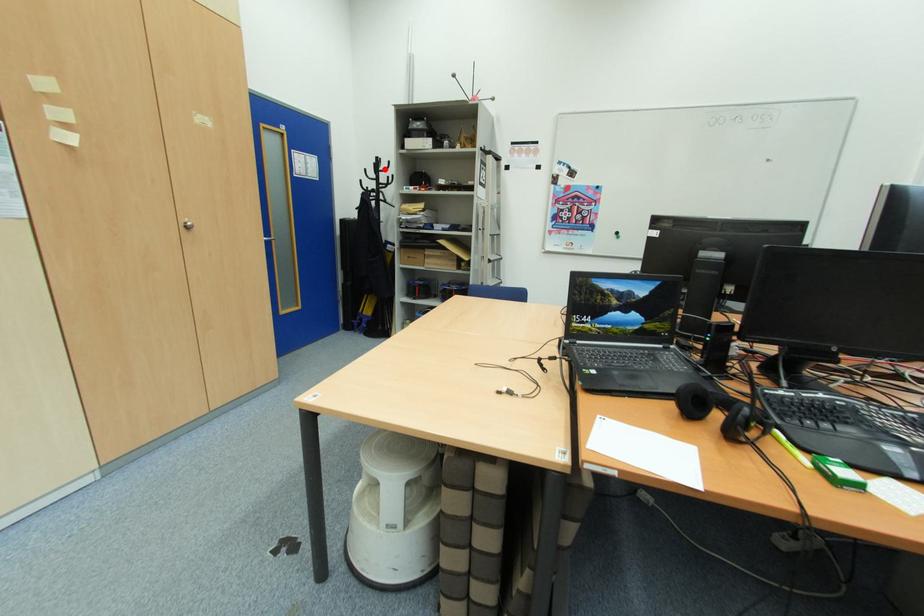
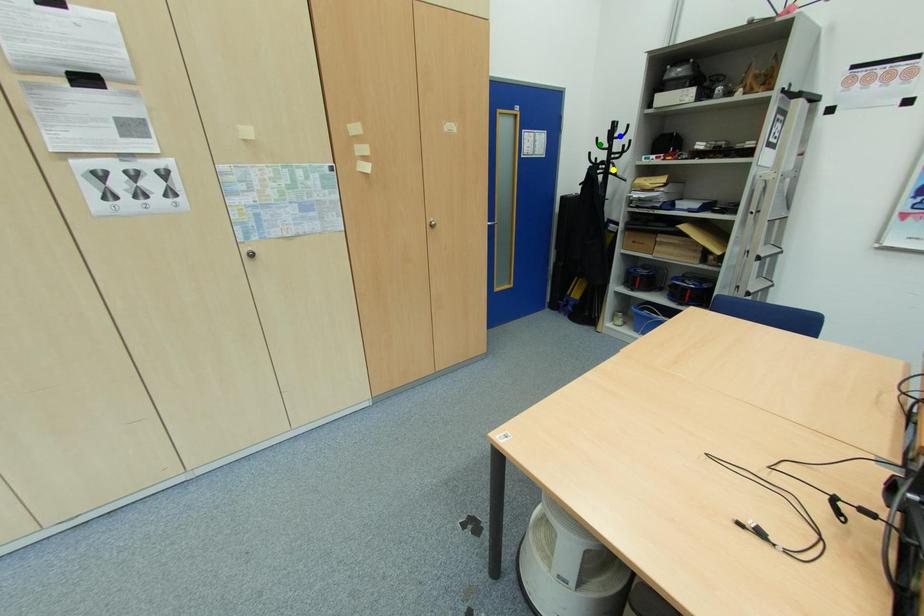
Question: I am providing you with two images of the same scene from different viewpoints. A red point is marked on the first image. You are given multiple points on the second image. Can you choose the point in image 2 that corresponds to the point in image 1?

Choices:
 (A) yellow point
 (B) blue point
 (C) green point

Answer: (B)